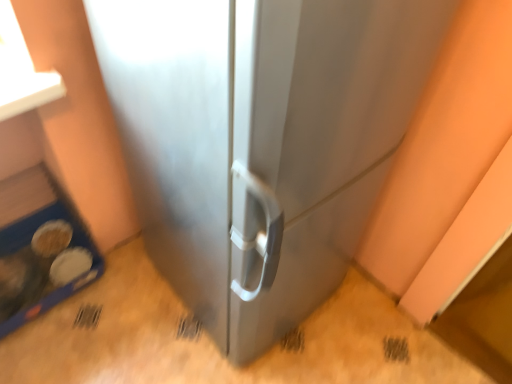
This screenshot has height=384, width=512. Describe the element at coordinates (261, 141) in the screenshot. I see `satin silver refrigerator at center` at that location.

Identify the location of satin silver refrigerator at center. (261, 141).

Locate an element on the screen. satin silver refrigerator at center is located at coordinates (261, 141).